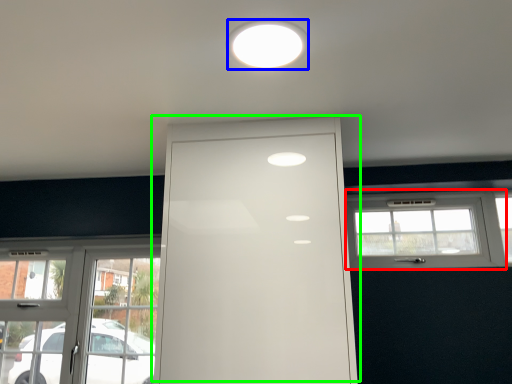
Question: Which object is the closest to the window (highlighted by a red box)? Choose among these: lighting (highlighted by a blue box) or door (highlighted by a green box).

Choices:
 (A) lighting
 (B) door

Answer: (B)